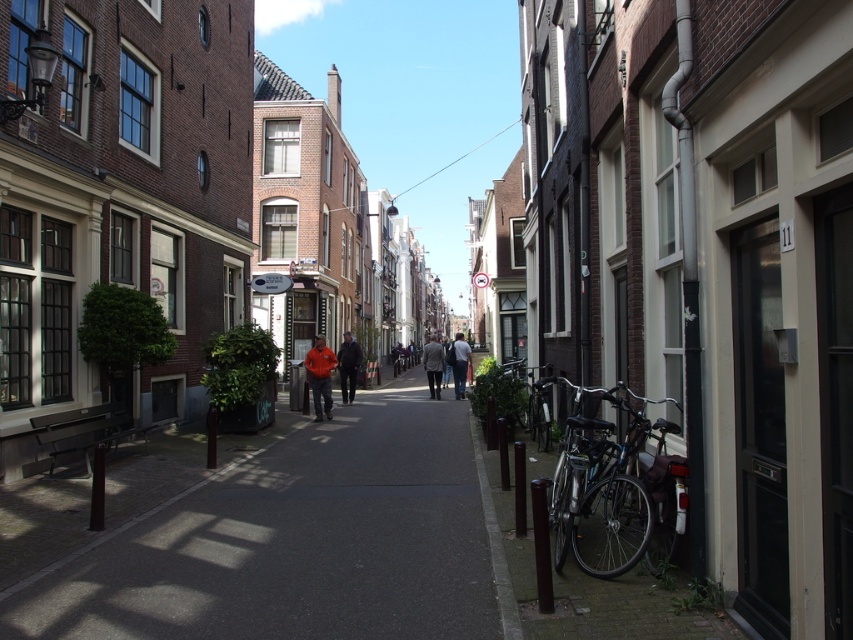
Question: Is smooth asphalt pavement at center above dark blue jacket at center?

Choices:
 (A) no
 (B) yes

Answer: (A)

Question: Does orange fleece jacket at center lie in front of dark blue jacket at center?

Choices:
 (A) yes
 (B) no

Answer: (A)

Question: Among these points, which one is nearest to the camera?

Choices:
 (A) tap(183, 536)
 (B) tap(355, 353)
 (C) tap(439, 384)
 (D) tap(310, 381)

Answer: (A)

Question: Which point is farther to the camera?

Choices:
 (A) dark blue jacket at center
 (B) smooth asphalt pavement at center
 (C) orange fleece jacket at center
 (D) light gray wool coat at center

Answer: (D)

Question: Can you confirm if light gray wool coat at center is thinner than orange jacket at center?

Choices:
 (A) no
 (B) yes

Answer: (A)

Question: Which point appears farthest from the camera in this image?

Choices:
 (A) (432, 353)
 (B) (358, 362)
 (C) (354, 621)
 (D) (456, 362)

Answer: (A)